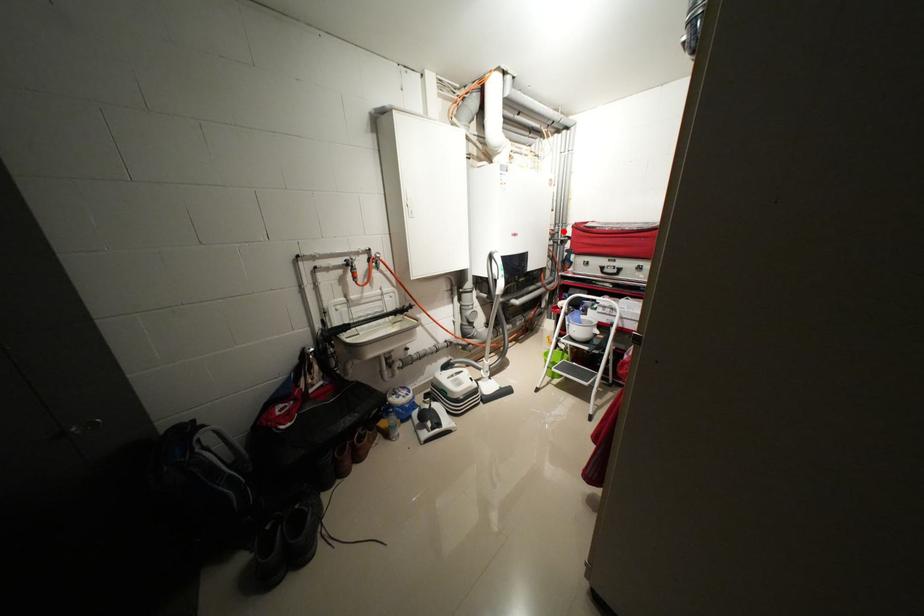
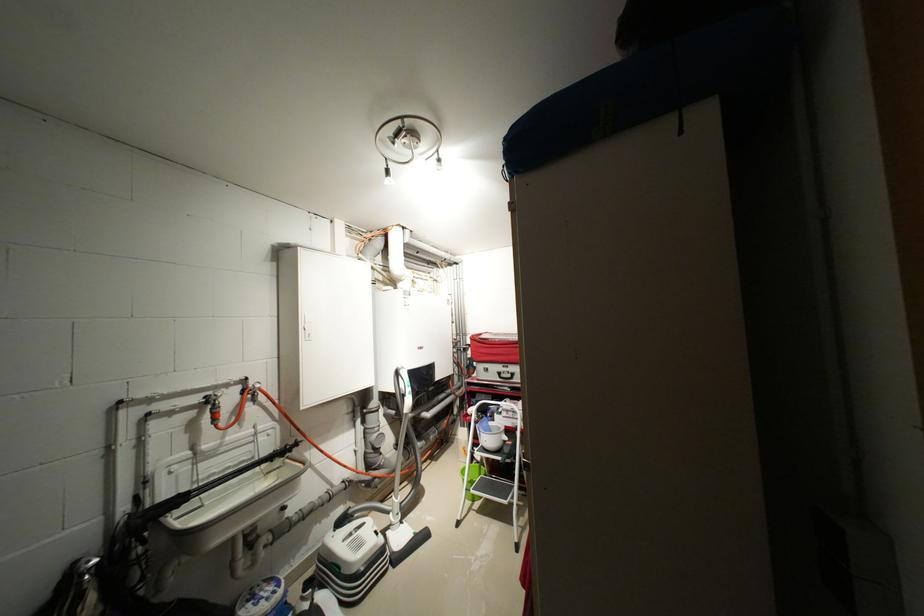
Question: I am providing you with two images of the same scene from different viewpoints. A red point is marked on the first image. At the location where the point appears in image 1, is it still visible in image 2?

Choices:
 (A) Yes
 (B) No

Answer: (A)